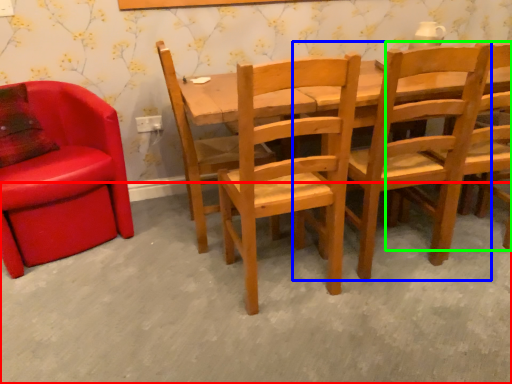
Question: Considering the real-world distances, which object is closest to concrete (highlighted by a red box)? chair (highlighted by a blue box) or chair (highlighted by a green box).

Choices:
 (A) chair
 (B) chair

Answer: (A)